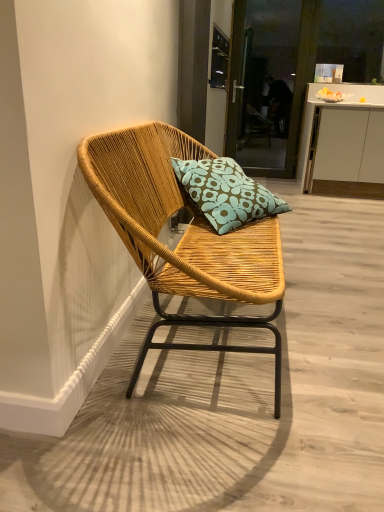
At what (x,y) coordinates should I click in order to perform the action: click on free space underneath woven wood chair at center (from a real-world perspective). Please return your answer as a coordinate pair (x, y). This screenshot has width=384, height=512. Looking at the image, I should click on (198, 369).